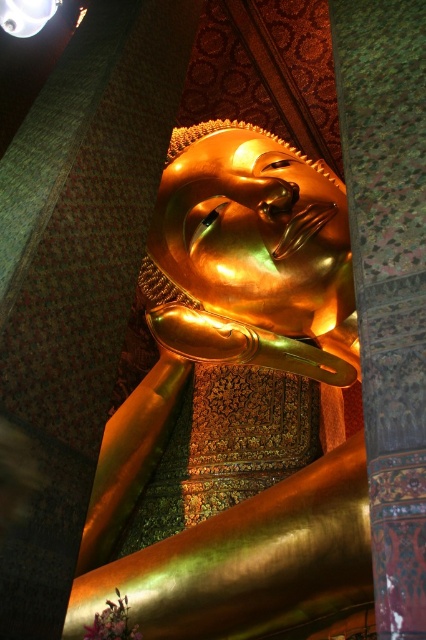
Between gold polished statue at center and metallic dome at upper left, which one has more height?

Standing taller between the two is gold polished statue at center.

At what (x,y) coordinates should I click in order to perform the action: click on gold polished statue at center. Please return your answer as a coordinate pair (x, y). Looking at the image, I should click on (238, 364).